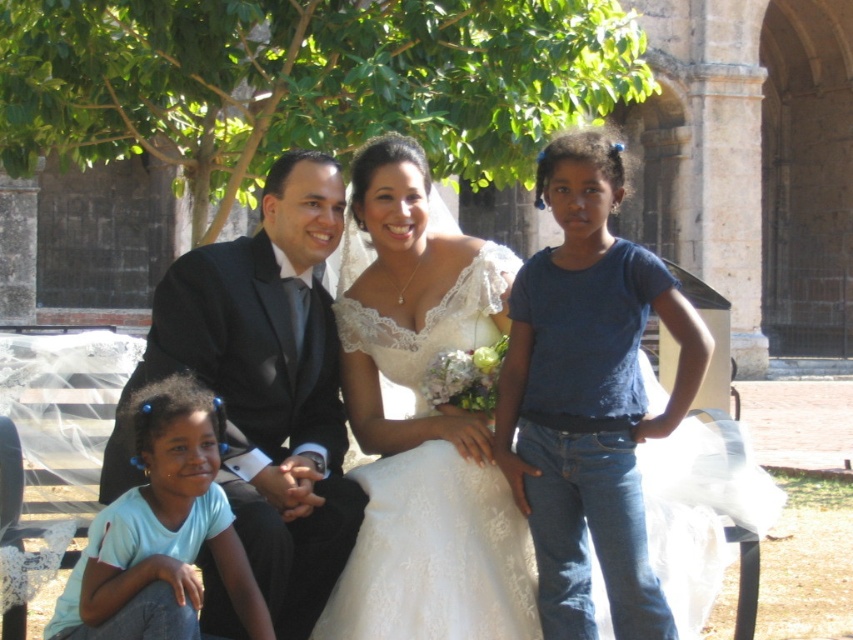
Question: Which object appears farthest from the camera in this image?

Choices:
 (A) shiny black suit at center
 (B) white lace dress at center
 (C) light blue t-shirt at lower left
 (D) blue denim jeans at center

Answer: (B)

Question: Is matte black suit at center below white lace dress at center?

Choices:
 (A) yes
 (B) no

Answer: (A)

Question: Which is farther from the white lace dress at center?

Choices:
 (A) matte black suit at center
 (B) light blue t-shirt at lower left

Answer: (B)

Question: Does matte black suit at center appear over shiny black suit at center?

Choices:
 (A) no
 (B) yes

Answer: (B)

Question: Which of the following is the farthest from the observer?

Choices:
 (A) (624, 394)
 (B) (90, 577)
 (C) (364, 310)
 (D) (569, 442)

Answer: (C)

Question: Observing the image, what is the correct spatial positioning of blue denim jeans at center in reference to light blue t-shirt at lower left?

Choices:
 (A) right
 (B) left

Answer: (A)